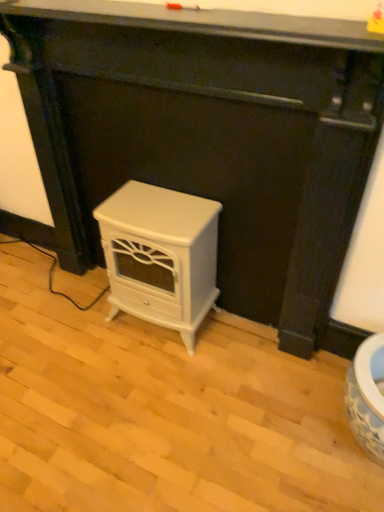
Question: Looking at their shapes, would you say smooth black surface at upper center is wider or thinner than white glossy stove at center, which is the first furniture in right-to-left order?

Choices:
 (A) wide
 (B) thin

Answer: (A)

Question: Relative to white glossy stove at center, which is the first furniture in right-to-left order, is smooth black surface at upper center in front or behind?

Choices:
 (A) behind
 (B) front

Answer: (B)

Question: Estimate the real-world distances between objects in this image. Which object is farther from the white glossy stove at center, placed as the 2th furniture when sorted from left to right?

Choices:
 (A) smooth black surface at upper center
 (B) white glossy electric stove at center, the 1th furniture positioned from the left

Answer: (A)

Question: Considering the real-world distances, which object is farthest from the smooth black surface at upper center?

Choices:
 (A) white glossy electric stove at center, arranged as the second furniture when viewed from the right
 (B) white glossy stove at center, placed as the 2th furniture when sorted from left to right

Answer: (A)